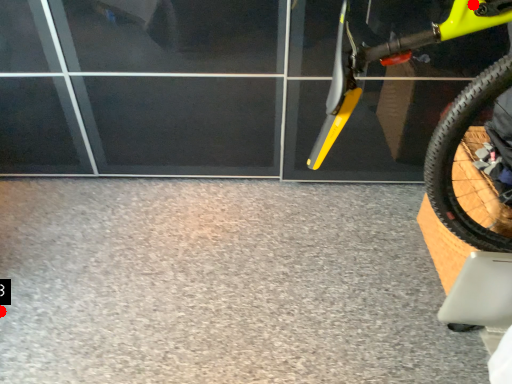
Question: Two points are circled on the image, labeled by A and B beside each circle. Which point appears farthest from the camera in this image?

Choices:
 (A) A is further
 (B) B is further

Answer: (B)